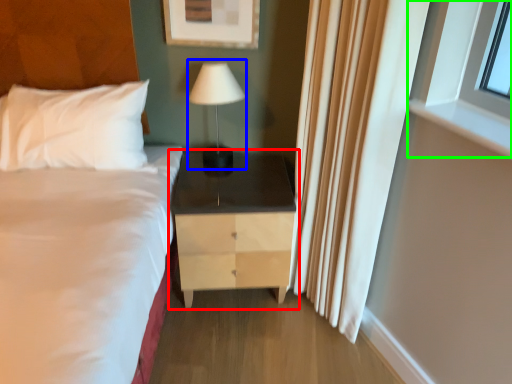
Question: Estimate the real-world distances between objects in this image. Which object is farther from nightstand (highlighted by a red box), table lamp (highlighted by a blue box) or window (highlighted by a green box)?

Choices:
 (A) table lamp
 (B) window

Answer: (B)